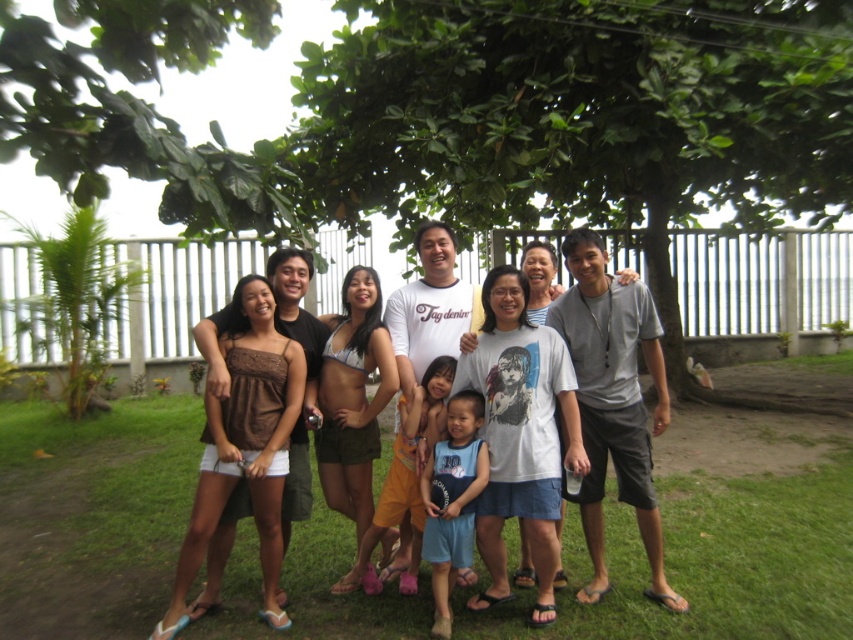
You are a photographer trying to adjust the composition of the image. You want to ensure that the brown fabric dress at left and the blue cotton shorts at center are both visible in the final shot. Which object should you focus on first to avoid blocking the other?

You should focus on the brown fabric dress at left first because it is positioned over the blue cotton shorts at center, meaning it is closer to the camera and might block the view of the shorts if not properly framed.

In the photo of the group under the large tree, there are two people wearing a brown fabric dress at left and blue cotton shorts at center. Which clothing item is positioned more to the left side of the image?

The brown fabric dress at left is positioned more to the left side of the image compared to the blue cotton shorts at center.

You are standing in a tropical garden and want to reach a specific point marked at coordinates point (24, 516). If your walking speed is 1.5 meters per second, how many seconds will it take you to reach that point?

The point (24, 516) is 5.84 meters away from the viewer. At a walking speed of 1.5 meters per second, it will take approximately 3.89 seconds to reach the point.